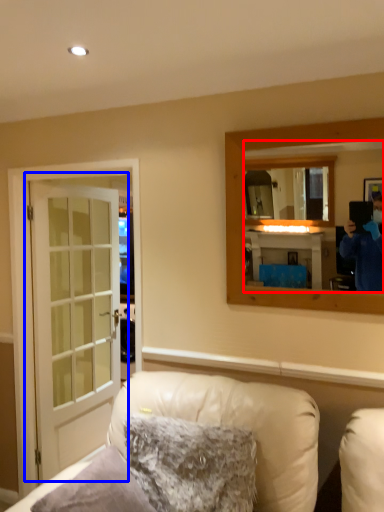
Question: Which of the following is the farthest to the observer, mirror (highlighted by a red box) or door (highlighted by a blue box)?

Choices:
 (A) mirror
 (B) door

Answer: (B)